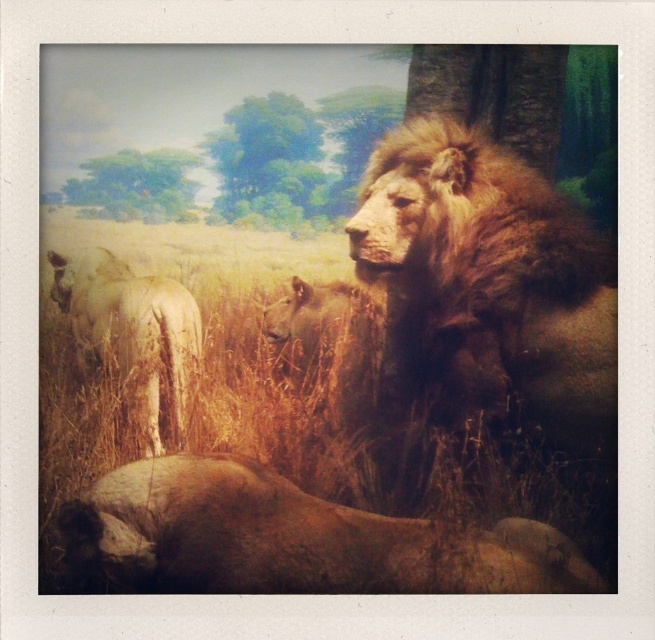
Does brown grass at center appear under brown furry lion at right?

Correct, brown grass at center is located below brown furry lion at right.

Is brown grass at center bigger than brown furry lion at right?

Indeed, brown grass at center has a larger size compared to brown furry lion at right.

Who is more forward, (124, 394) or (557, 381)?

Point (557, 381) is more forward.

Find the location of a particular element. The image size is (655, 640). brown grass at center is located at coordinates (246, 433).

Is brown furry lion at right behind brown fur lion at lower center?

Yes, brown furry lion at right is further from the viewer.

Is brown furry lion at right wider than brown fur lion at lower center?

Incorrect, brown furry lion at right's width does not surpass brown fur lion at lower center's.

Between point (360, 266) and point (396, 579), which one is positioned behind?

Point (360, 266)

The height and width of the screenshot is (640, 655). I want to click on brown furry lion at right, so click(x=489, y=284).

Is brown furry lion at right above brown textured lion at left?

Yes, brown furry lion at right is above brown textured lion at left.

Does brown furry lion at right come behind brown textured lion at left?

No, it is in front of brown textured lion at left.

The image size is (655, 640). I want to click on brown furry lion at right, so click(489, 284).